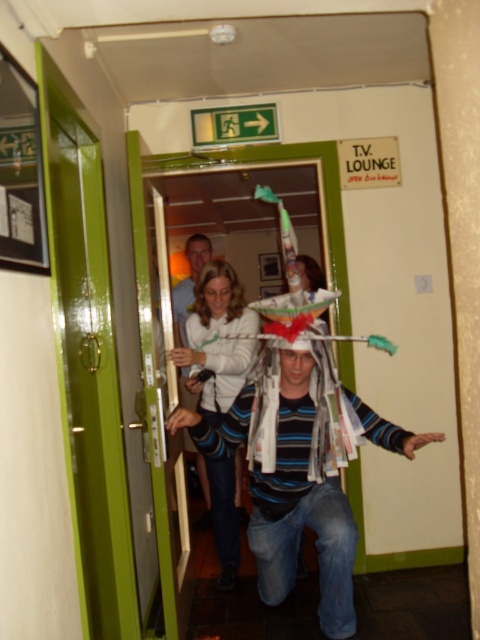
You are standing at the entrance of the T.V. Lounge and see a point marked at coordinates (x=217, y=339). What is this point located on?

The point at (x=217, y=339) is located on the white fabric at center.

You are a guest at a costume party and see the man in the striped cotton shirt at center and the white fabric at center. Which item is positioned lower on his body?

The white fabric at center is located below the striped cotton shirt at center, so it is positioned lower on his body.

You are standing in front of the T.V. LOUNGE door and see two points marked in the image. Which point, point (201, 356) or point (189, 276), is closer to you?

Point (201, 356) is closer to the camera than point (189, 276), so the point closer to you is point (201, 356).